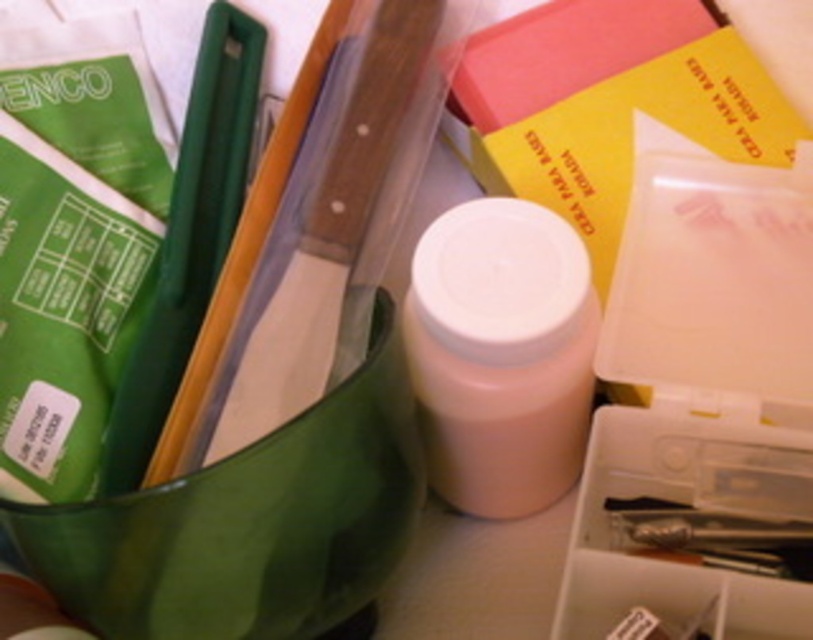
Can you confirm if white plastic container at center-right is positioned to the left of white matte bottle at center?

In fact, white plastic container at center-right is to the right of white matte bottle at center.

Based on the photo, is white plastic container at center-right smaller than white matte bottle at center?

No.

Does point (575, 636) lie in front of point (524, 346)?

No, it is behind (524, 346).

Identify the location of white plastic container at center-right. (701, 392).